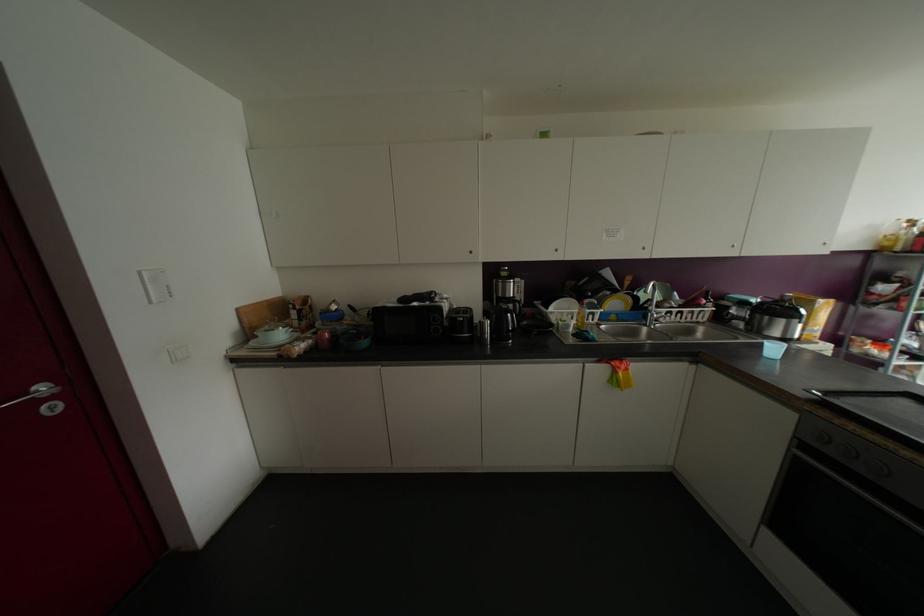
Find where to pull the black oven handle. Please return your answer as a coordinate pair (x, y).

(858, 487)